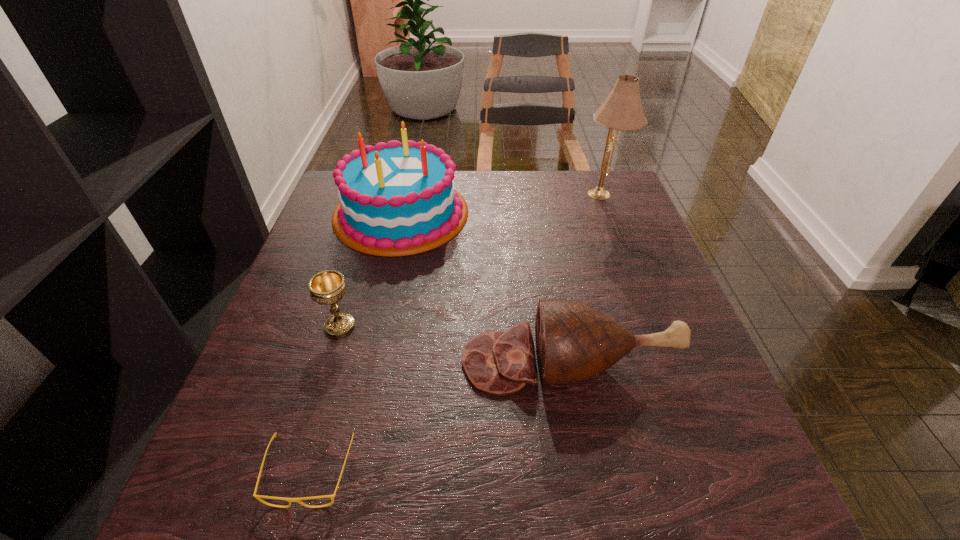
The width and height of the screenshot is (960, 540). I want to click on the closest object to the chalice, so click(x=396, y=199).

Locate an element on the screen. This screenshot has height=540, width=960. vacant space that satisfies the following two spatial constraints: 1. on the back side of the lampshade; 2. on the right side of the birthday cake is located at coordinates (405, 194).